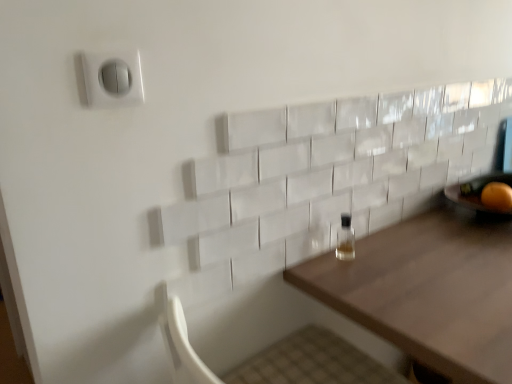
The height and width of the screenshot is (384, 512). I want to click on clear glass bottle at center, so click(345, 239).

The image size is (512, 384). Describe the element at coordinates (111, 79) in the screenshot. I see `white plastic switch at upper left` at that location.

Where is `clear glass bottle at center`? clear glass bottle at center is located at coordinates coord(345,239).

Would you say orange matte at right is to the left or to the right of wooden table at center in the picture?

From the image, it's evident that orange matte at right is to the left of wooden table at center.

From a real-world perspective, which is physically below, orange matte at right or wooden table at center?

wooden table at center.

Can you confirm if orange matte at right is wider than wooden table at center?

In fact, orange matte at right might be narrower than wooden table at center.

Who is smaller, orange matte at right or wooden table at center?

Smaller between the two is orange matte at right.

From a real-world perspective, is wooden table at center physically located above or below orange matte at right?

wooden table at center is below orange matte at right.

Is wooden table at center in front of or behind orange matte at right in the image?

In the image, wooden table at center appears in front of orange matte at right.

Consider the image. Can you confirm if wooden table at center is thinner than orange matte at right?

No.

Which is in front, clear glass bottle at center or wooden table at center?

wooden table at center is in front.

Where is `table lying in front of the clear glass bottle at center`? The width and height of the screenshot is (512, 384). table lying in front of the clear glass bottle at center is located at coordinates (428, 291).

Does clear glass bottle at center appear on the right side of wooden table at center?

In fact, clear glass bottle at center is to the left of wooden table at center.

Is point (505, 204) positioned after point (343, 225)?

Yes, it is.

Can you see orange matte at right touching clear glass bottle at center?

No, orange matte at right is not next to clear glass bottle at center.

From a real-world perspective, is orange matte at right positioned under clear glass bottle at center based on gravity?

No, from a real-world perspective, orange matte at right is not below clear glass bottle at center.

From the image's perspective, does wooden table at center appear lower than clear glass bottle at center?

Yes, from the image's perspective, wooden table at center is beneath clear glass bottle at center.

Looking at this image, considering the relative sizes of wooden table at center and clear glass bottle at center in the image provided, is wooden table at center taller than clear glass bottle at center?

Indeed, wooden table at center has a greater height compared to clear glass bottle at center.

Does wooden table at center have a larger size compared to clear glass bottle at center?

Yes.

Is wooden table at center in front of or behind clear glass bottle at center in the image?

In the image, wooden table at center appears in front of clear glass bottle at center.

From a real-world perspective, is clear glass bottle at center beneath white plastic switch at upper left?

Yes, from a real-world perspective, clear glass bottle at center is beneath white plastic switch at upper left.

Is clear glass bottle at center far away from white plastic switch at upper left?

That's not correct — clear glass bottle at center is a little close to white plastic switch at upper left.

Is point (340, 238) less distant than point (100, 79)?

That is False.

Which object is wider, clear glass bottle at center or white plastic switch at upper left?

With larger width is clear glass bottle at center.

Locate an element on the screen. table behind the white plastic switch at upper left is located at coordinates (428, 291).

Is wooden table at center turned away from white plastic switch at upper left?

No, wooden table at center's orientation is not away from white plastic switch at upper left.

Is point (430, 218) closer or farther from the camera than point (115, 104)?

Point (430, 218).

Image resolution: width=512 pixels, height=384 pixels. Identify the location of table below the orange matte at right (from a real-world perspective). (428, 291).

Find the location of a particular element. This screenshot has width=512, height=384. table below the orange matte at right (from the image's perspective) is located at coordinates (428, 291).

Looking at the image, which one is located closer to orange matte at right, white plastic switch at upper left or wooden table at center?

wooden table at center is positioned closer to the anchor orange matte at right.

Considering their positions, is wooden table at center positioned closer to orange matte at right than clear glass bottle at center?

wooden table at center is positioned closer to the anchor orange matte at right.

Which object lies further to the anchor point clear glass bottle at center, wooden table at center or white plastic switch at upper left?

white plastic switch at upper left is further to clear glass bottle at center.

Estimate the real-world distances between objects in this image. Which object is further from wooden table at center, white plastic switch at upper left or clear glass bottle at center?

white plastic switch at upper left.

From the image, which object appears to be farther from orange matte at right, wooden table at center or white plastic switch at upper left?

The object further to orange matte at right is white plastic switch at upper left.

Which object lies further to the anchor point orange matte at right, white plastic switch at upper left or clear glass bottle at center?

Based on the image, white plastic switch at upper left appears to be further to orange matte at right.

Based on their spatial positions, is wooden table at center or clear glass bottle at center further from white plastic switch at upper left?

wooden table at center is further to white plastic switch at upper left.

Estimate the real-world distances between objects in this image. Which object is further from white plastic switch at upper left, orange matte at right or wooden table at center?

orange matte at right lies further to white plastic switch at upper left than the other object.

Find the location of `bottle between white plastic switch at upper left and orange matte at right`. bottle between white plastic switch at upper left and orange matte at right is located at coordinates (345, 239).

The width and height of the screenshot is (512, 384). I want to click on bottle between white plastic switch at upper left and wooden table at center, so click(345, 239).

Locate an element on the screen. orange between clear glass bottle at center and wooden table at center is located at coordinates (497, 197).

You are a GUI agent. You are given a task and a screenshot of the screen. Output one action in this format:
    pyautogui.click(x=<x>, y=<y>)
    Task: Click on the orange situated between white plastic switch at upper left and wooden table at center from left to right
    The width and height of the screenshot is (512, 384).
    Given the screenshot: What is the action you would take?
    [x=497, y=197]